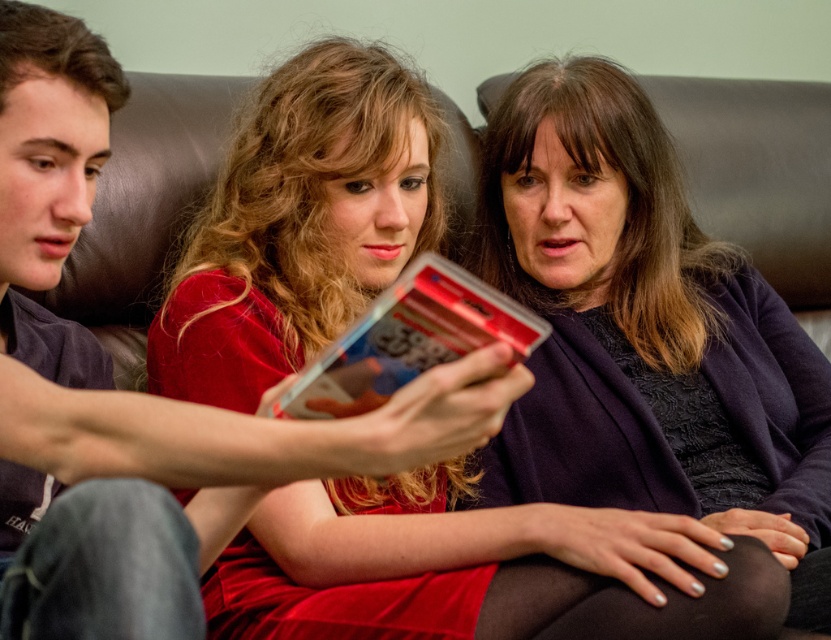
You are standing in the living room and see the matte black sweater at center and the matte black shirt at left. Which one is closer to the right side of the room?

The matte black sweater at center is closer to the right side of the room because it is positioned to the right of the matte black shirt at left.

You are trying to locate the shiny plastic card at center. Where is the matte black sweater at center in relation to it?

The matte black sweater at center is to the right of the shiny plastic card at center.

Based on the photo, you are a photographer trying to capture a clear shot of both the velvet red dress at center and the shiny plastic card at center. Since you can only focus on one object at a time, which one should you choose to ensure the other remains in the background?

You should focus on the velvet red dress at center because it is closer to the viewer than the shiny plastic card at center, so the card will naturally be in the background if the dress is in focus.